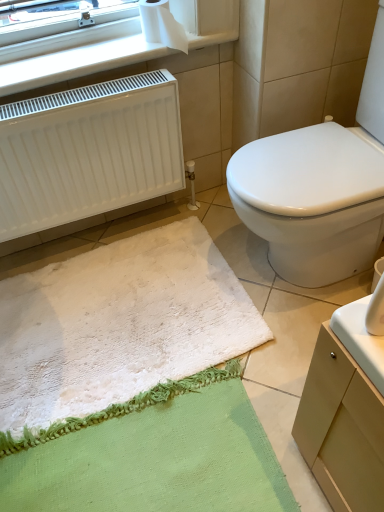
Image resolution: width=384 pixels, height=512 pixels. In order to click on free space to the left of white paper at upper left in this screenshot , I will do `click(113, 54)`.